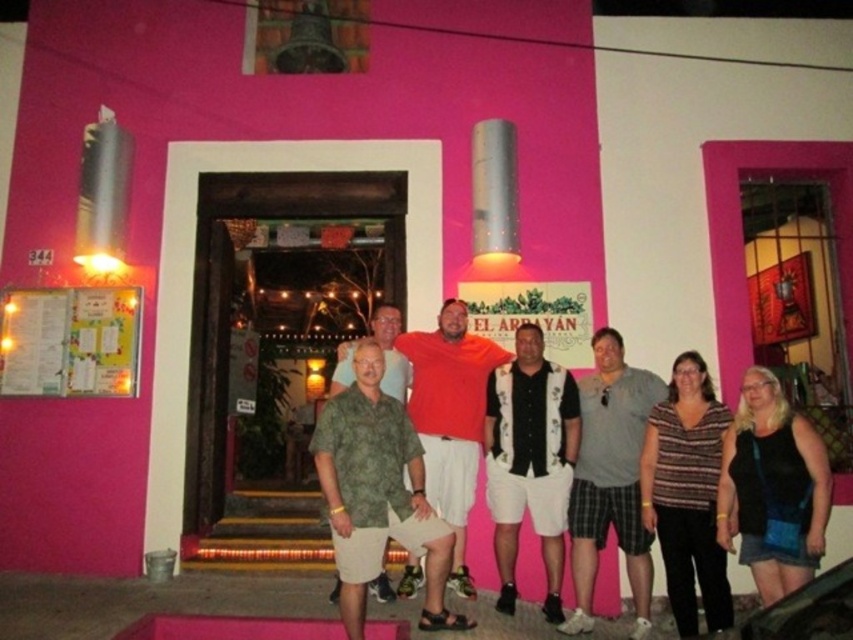
Between black textured shirt at center and gray cotton t-shirt at center, which one has less height?

black textured shirt at center is shorter.

Which is behind, point (500, 563) or point (650, 588)?

The point (500, 563) is behind.

The width and height of the screenshot is (853, 640). I want to click on black textured shirt at center, so click(531, 461).

Which is behind, point (537, 330) or point (670, 440)?

Point (537, 330)

Does black textured shirt at center have a greater width compared to striped fabric shirt at center?

Yes.

The width and height of the screenshot is (853, 640). In order to click on black textured shirt at center in this screenshot , I will do `click(531, 461)`.

You are a GUI agent. You are given a task and a screenshot of the screen. Output one action in this format:
    pyautogui.click(x=<x>, y=<y>)
    Task: Click on the black textured shirt at center
    The image size is (853, 640).
    Given the screenshot: What is the action you would take?
    pyautogui.click(x=531, y=461)

Can you confirm if black textured shirt at center is positioned to the left of matte orange shirt at center?

No, black textured shirt at center is not to the left of matte orange shirt at center.

Can you confirm if black textured shirt at center is thinner than matte orange shirt at center?

Correct, black textured shirt at center's width is less than matte orange shirt at center's.

Which is in front, point (560, 464) or point (467, 384)?

Point (560, 464)

Locate an element on the screen. The height and width of the screenshot is (640, 853). black textured shirt at center is located at coordinates (531, 461).